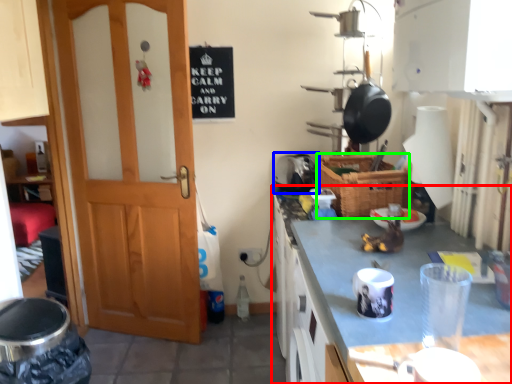
Question: Which is farther away from cabinetry (highlighted by a red box)? appliance (highlighted by a blue box) or basket (highlighted by a green box)?

Choices:
 (A) appliance
 (B) basket

Answer: (A)